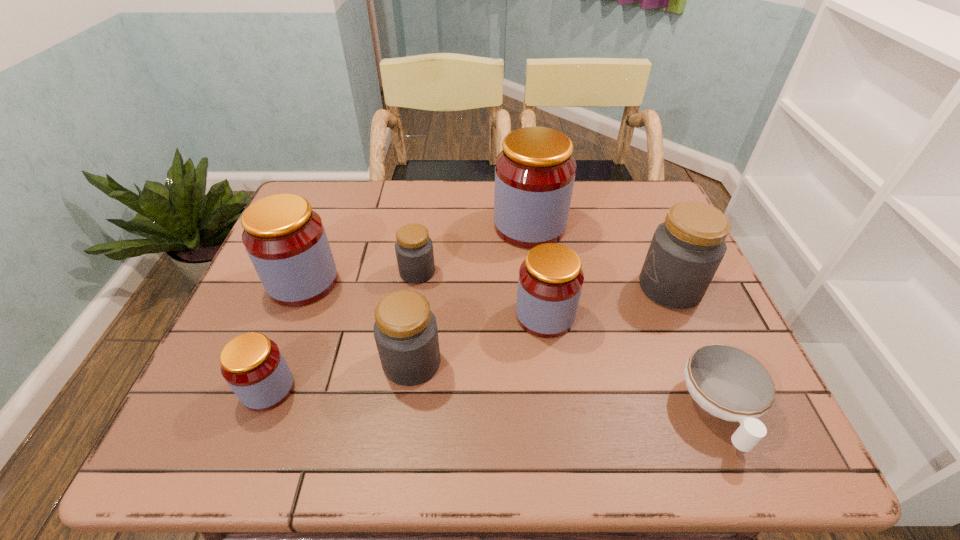
This screenshot has height=540, width=960. Identify the location of object present at the far edge. (534, 173).

This screenshot has width=960, height=540. I want to click on object that is at the near edge, so click(x=727, y=382).

The image size is (960, 540). Find the location of `jar positioned at the right edge`. jar positioned at the right edge is located at coordinates (686, 250).

Where is `chinaware positioned at the right edge`? The width and height of the screenshot is (960, 540). chinaware positioned at the right edge is located at coordinates (727, 382).

Where is `object that is at the near right corner`? Image resolution: width=960 pixels, height=540 pixels. object that is at the near right corner is located at coordinates (727, 382).

The height and width of the screenshot is (540, 960). In order to click on vacant region at the far edge of the desktop in this screenshot , I will do `click(357, 198)`.

Where is `free spot at the near edge of the desktop`? The height and width of the screenshot is (540, 960). free spot at the near edge of the desktop is located at coordinates (619, 457).

This screenshot has width=960, height=540. What are the coordinates of `free space at the left edge of the desktop` in the screenshot? It's located at (247, 295).

The image size is (960, 540). In order to click on free space at the right edge of the desktop in this screenshot , I will do tap(628, 226).

Where is `vacant space at the far right corner of the desktop`? The width and height of the screenshot is (960, 540). vacant space at the far right corner of the desktop is located at coordinates (657, 185).